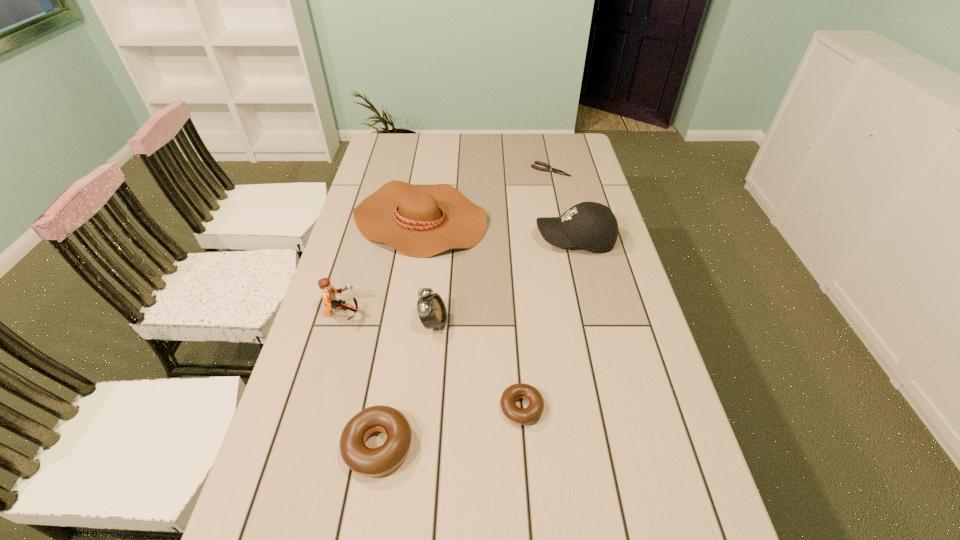
Locate an element on the screen. This screenshot has height=540, width=960. cowboy hat situated at the left edge is located at coordinates (420, 221).

Find the location of a particular element. Image resolution: width=960 pixels, height=540 pixels. Lego present at the left edge is located at coordinates (329, 292).

You are a GUI agent. You are given a task and a screenshot of the screen. Output one action in this format:
    pyautogui.click(x=<x>, y=<y>)
    Task: Click on the pliers located at the right edge
    This screenshot has height=540, width=960.
    Given the screenshot: What is the action you would take?
    tap(548, 168)

At what (x,y) coordinates should I click in order to perform the action: click on baseball cap at the right edge. Please return your answer as a coordinate pair (x, y). The width and height of the screenshot is (960, 540). Looking at the image, I should click on (592, 226).

Identify the location of vacant space at the far edge. The image size is (960, 540). (494, 151).

I want to click on free space at the near edge, so click(x=397, y=527).

In the image, there is a desktop. At what (x,y) coordinates should I click in order to perform the action: click on free space at the left edge. Please return your answer as a coordinate pair (x, y). The height and width of the screenshot is (540, 960). Looking at the image, I should click on (287, 408).

Locate an element on the screen. vacant area at the right edge of the desktop is located at coordinates (587, 170).

I want to click on free space at the near left corner, so click(292, 523).

The height and width of the screenshot is (540, 960). In the image, there is a desktop. In order to click on free region at the far right corner in this screenshot , I will do `click(570, 145)`.